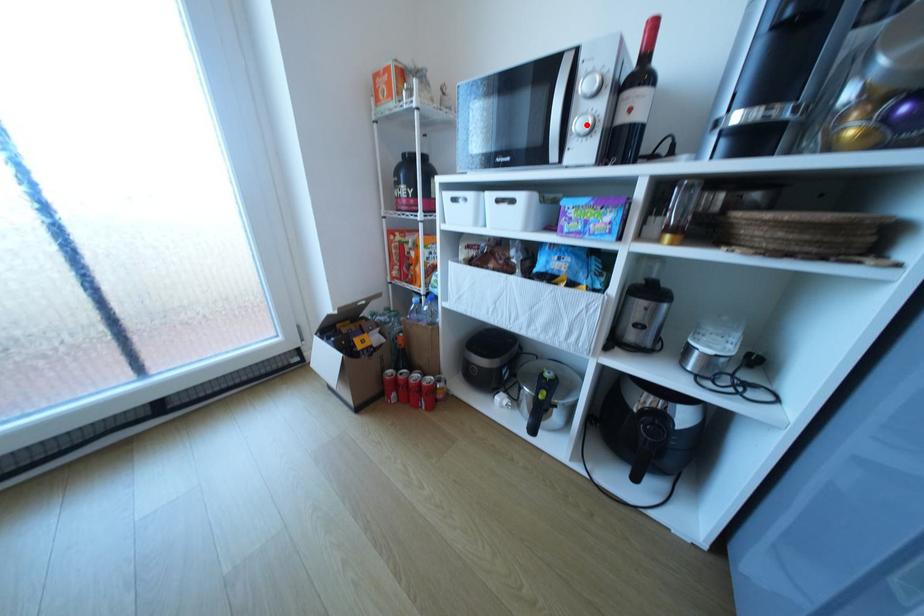
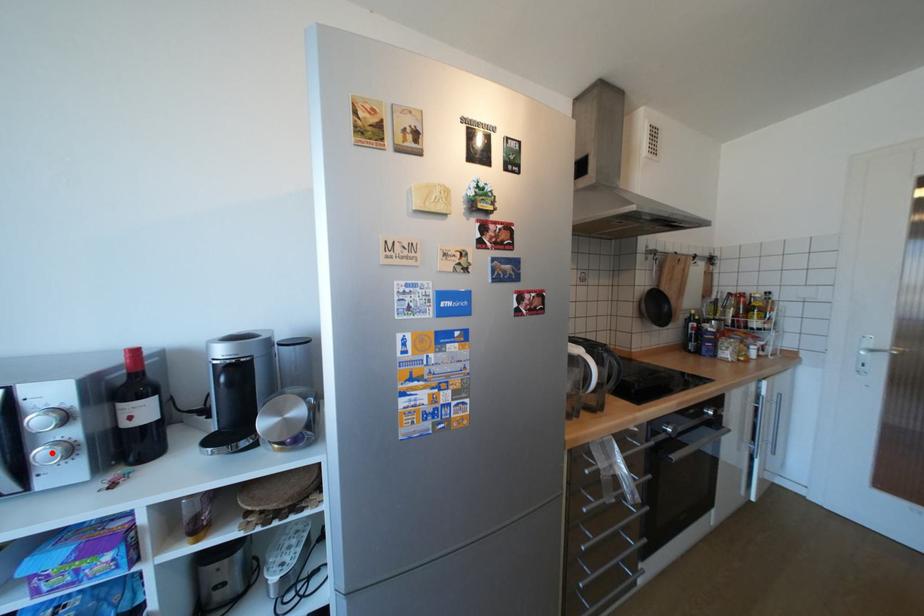
I am providing you with two images of the same scene from different viewpoints. A red point is marked on the first image and another point is marked on the second image. Is the marked point in image1 the same physical position as the marked point in image2?

Yes